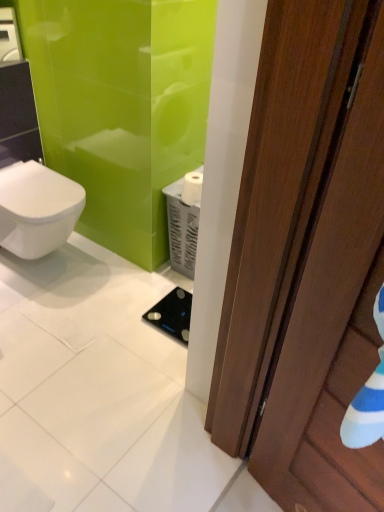
Question: Does white glossy bidet at left have a greater width compared to brown wooden door at right?

Choices:
 (A) yes
 (B) no

Answer: (A)

Question: Does white glossy bidet at left have a larger size compared to brown wooden door at right?

Choices:
 (A) yes
 (B) no

Answer: (A)

Question: Is white glossy bidet at left oriented towards brown wooden door at right?

Choices:
 (A) no
 (B) yes

Answer: (B)

Question: From the image's perspective, is white glossy bidet at left located beneath brown wooden door at right?

Choices:
 (A) yes
 (B) no

Answer: (B)

Question: Can brown wooden door at right be found inside white glossy bidet at left?

Choices:
 (A) yes
 (B) no

Answer: (B)

Question: Is white glossy bidet at left to the left of brown wooden door at right from the viewer's perspective?

Choices:
 (A) no
 (B) yes

Answer: (B)

Question: From the image's perspective, is brown wooden door at right located beneath white matte toilet paper at center?

Choices:
 (A) no
 (B) yes

Answer: (B)

Question: Can you confirm if brown wooden door at right is bigger than white matte toilet paper at center?

Choices:
 (A) no
 (B) yes

Answer: (B)

Question: Is the surface of brown wooden door at right in direct contact with white matte toilet paper at center?

Choices:
 (A) no
 (B) yes

Answer: (A)

Question: Would you say brown wooden door at right is a long distance from white matte toilet paper at center?

Choices:
 (A) no
 (B) yes

Answer: (B)

Question: Is white matte toilet paper at center surrounded by brown wooden door at right?

Choices:
 (A) no
 (B) yes

Answer: (A)

Question: Considering the relative sizes of brown wooden door at right and white matte toilet paper at center in the image provided, is brown wooden door at right smaller than white matte toilet paper at center?

Choices:
 (A) yes
 (B) no

Answer: (B)

Question: Is black glass scale at center far away from white matte toilet paper at center?

Choices:
 (A) no
 (B) yes

Answer: (A)